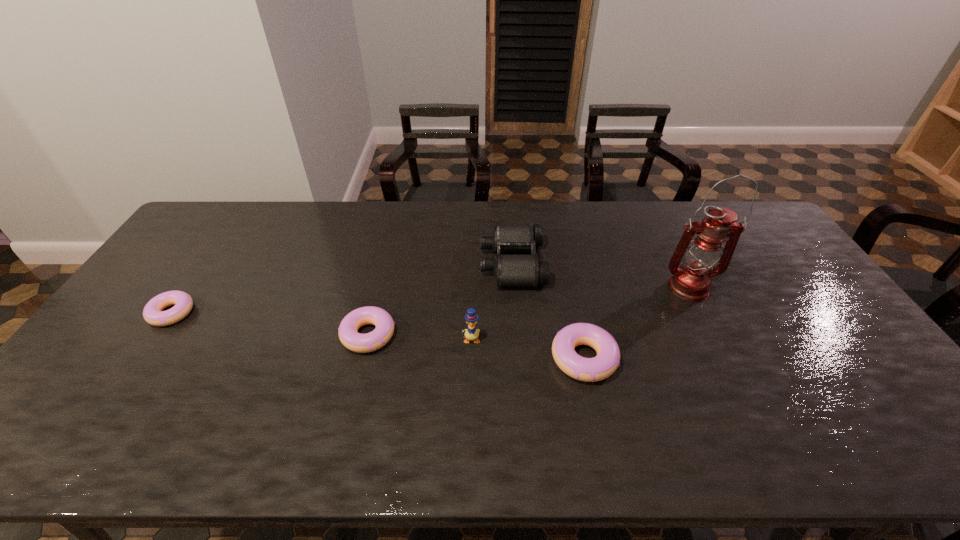
Find the location of a particular element. This screenshot has width=960, height=540. free region located on the back of the leftmost object is located at coordinates (228, 231).

Identify the location of blank area located on the right of the fifth tallest object. (500, 335).

Image resolution: width=960 pixels, height=540 pixels. Identify the location of free space located 0.130m on the back of the rightmost doughnut. (571, 299).

Where is `free space located on the back of the oil lamp`? This screenshot has width=960, height=540. free space located on the back of the oil lamp is located at coordinates (656, 223).

Where is `vacant position located 0.310m through the eyepieces of the fourth shortest object`? The image size is (960, 540). vacant position located 0.310m through the eyepieces of the fourth shortest object is located at coordinates point(386,263).

Locate an element on the screen. The width and height of the screenshot is (960, 540). free space located through the eyepieces of the fourth shortest object is located at coordinates pyautogui.click(x=435, y=263).

You are a GUI agent. You are given a task and a screenshot of the screen. Output one action in this format:
    pyautogui.click(x=<x>, y=<y>)
    Task: Click on the vacant space located through the eyepieces of the fourth shortest object
    This screenshot has width=960, height=540.
    Given the screenshot: What is the action you would take?
    pyautogui.click(x=368, y=263)

Locate an element on the screen. The height and width of the screenshot is (540, 960). vacant space positioned 0.150m on the face of the duckling, where the monocle is placed is located at coordinates (470, 394).

At what (x,y) coordinates should I click in order to perform the action: click on object present at the far edge. Please return your answer as a coordinate pair (x, y). The image size is (960, 540). Looking at the image, I should click on (509, 270).

Where is `object positioned at the near edge`? The width and height of the screenshot is (960, 540). object positioned at the near edge is located at coordinates (598, 368).